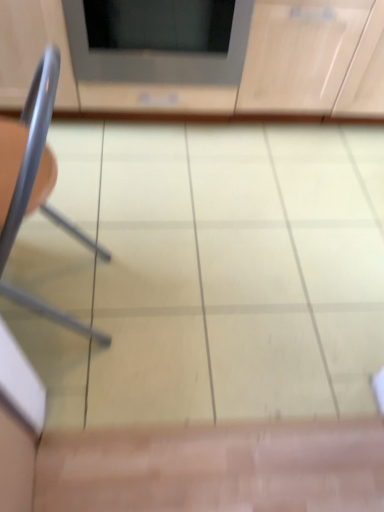
Question: From the image's perspective, is metallic gray chair at left under matte wood cabinet at upper center?

Choices:
 (A) no
 (B) yes

Answer: (B)

Question: Would you say matte wood cabinet at upper center is part of metallic gray chair at left's contents?

Choices:
 (A) no
 (B) yes

Answer: (A)

Question: From a real-world perspective, is metallic gray chair at left on top of matte wood cabinet at upper center?

Choices:
 (A) no
 (B) yes

Answer: (B)

Question: Does metallic gray chair at left have a lesser width compared to matte wood cabinet at upper center?

Choices:
 (A) no
 (B) yes

Answer: (B)

Question: Considering the relative sizes of metallic gray chair at left and matte wood cabinet at upper center in the image provided, is metallic gray chair at left smaller than matte wood cabinet at upper center?

Choices:
 (A) yes
 (B) no

Answer: (A)

Question: Is metallic gray chair at left at the left side of matte wood cabinet at upper center?

Choices:
 (A) no
 (B) yes

Answer: (B)

Question: Is metallic gray chair at left further to camera compared to matte gray microwave at upper center?

Choices:
 (A) no
 (B) yes

Answer: (A)

Question: Is metallic gray chair at left outside matte gray microwave at upper center?

Choices:
 (A) yes
 (B) no

Answer: (A)

Question: Would you say metallic gray chair at left is a long distance from matte gray microwave at upper center?

Choices:
 (A) yes
 (B) no

Answer: (B)

Question: From the image's perspective, is metallic gray chair at left above matte gray microwave at upper center?

Choices:
 (A) yes
 (B) no

Answer: (B)

Question: Is metallic gray chair at left to the left of matte gray microwave at upper center from the viewer's perspective?

Choices:
 (A) no
 (B) yes

Answer: (B)

Question: Is metallic gray chair at left to the right of matte gray microwave at upper center from the viewer's perspective?

Choices:
 (A) yes
 (B) no

Answer: (B)

Question: Is matte gray microwave at upper center facing towards metallic gray chair at left?

Choices:
 (A) yes
 (B) no

Answer: (A)